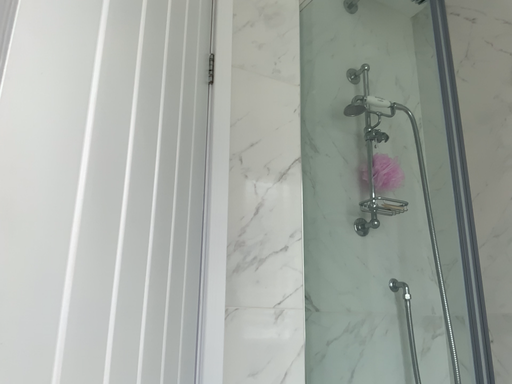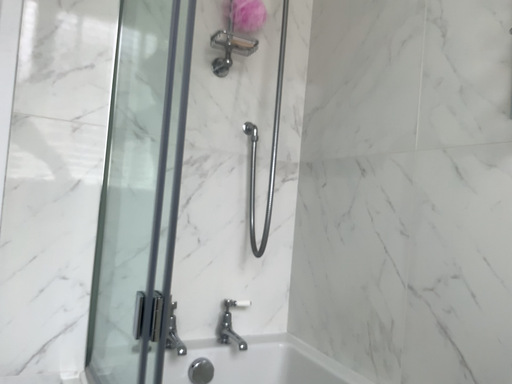
Question: Which way did the camera rotate in the video?

Choices:
 (A) rotated upward
 (B) rotated downward

Answer: (B)